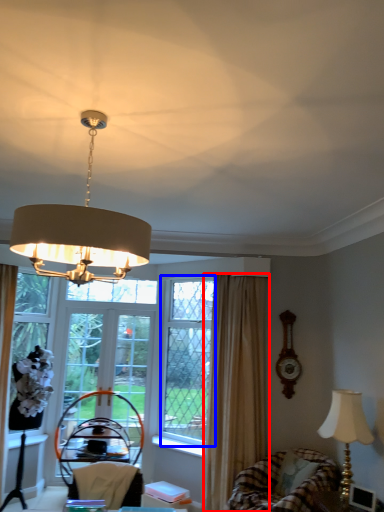
Question: Which of the following is the farthest to the observer, curtain (highlighted by a red box) or window screen (highlighted by a blue box)?

Choices:
 (A) curtain
 (B) window screen

Answer: (B)